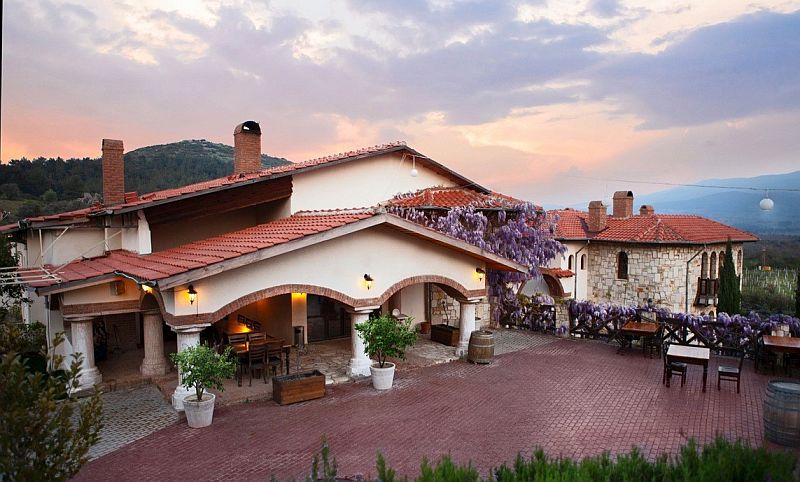
The height and width of the screenshot is (482, 800). I want to click on white plant container, so click(385, 375).